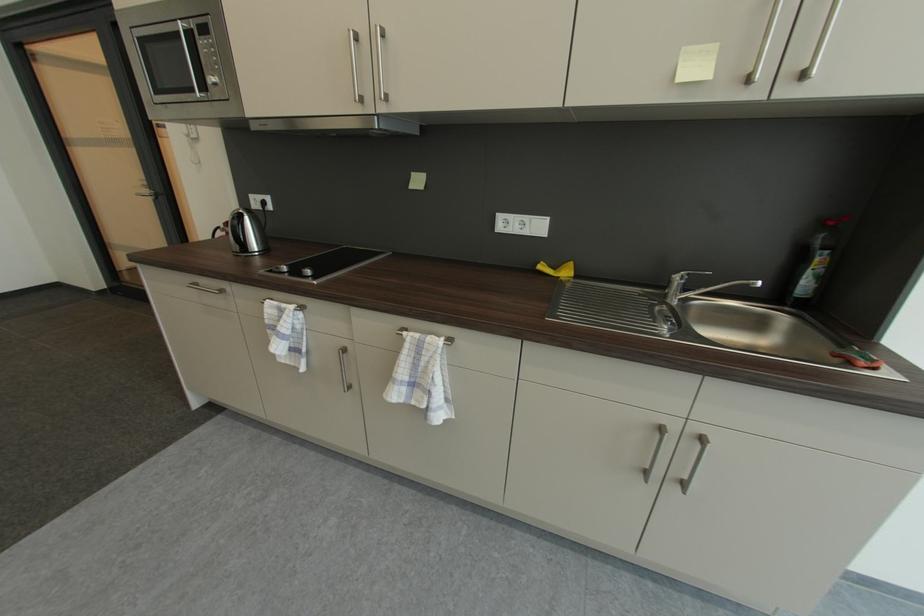
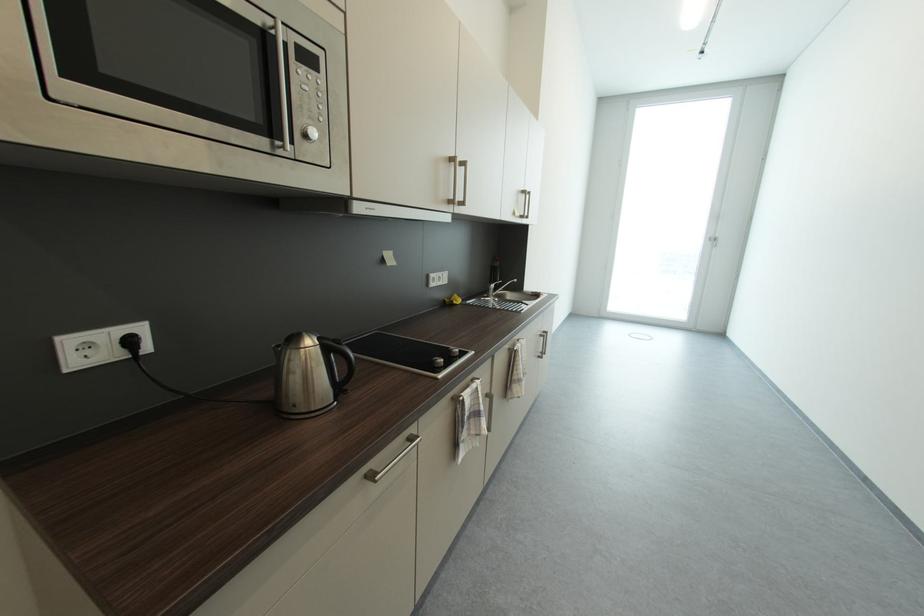
The point at (x=273, y=323) is marked in the first image. Where is the corresponding point in the second image?

(472, 419)